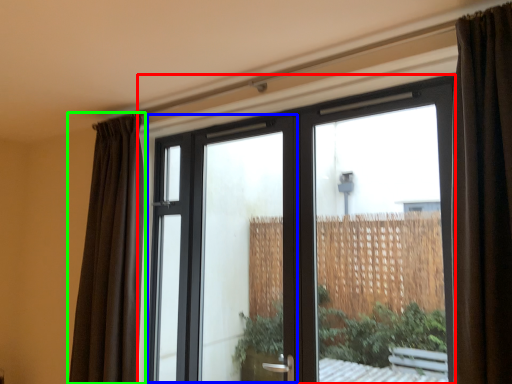
Question: Based on their relative distances, which object is farther from window (highlighted by a red box)? Choose from screen door (highlighted by a blue box) and curtain (highlighted by a green box).

Choices:
 (A) screen door
 (B) curtain

Answer: (B)